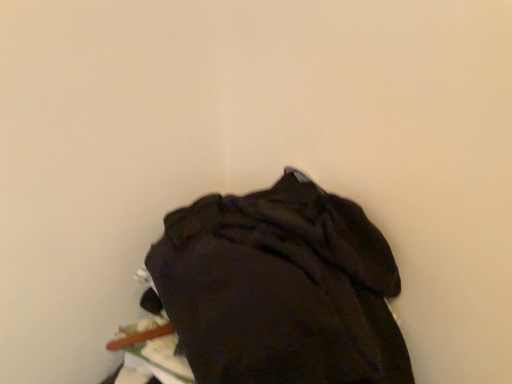
Locate an element on the screen. This screenshot has height=384, width=512. dark matte jacket at lower center is located at coordinates (279, 289).

What do you see at coordinates (279, 289) in the screenshot? I see `dark matte jacket at lower center` at bounding box center [279, 289].

The height and width of the screenshot is (384, 512). In order to click on dark matte jacket at lower center in this screenshot , I will do `click(279, 289)`.